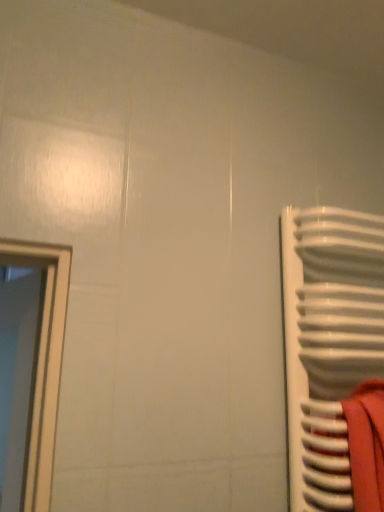
In the scene shown: In order to face white glossy radiator at right, should I rotate leftwards or rightwards?

To face it directly, rotate right by 24.909 degrees.

You are a GUI agent. You are given a task and a screenshot of the screen. Output one action in this format:
    pyautogui.click(x=<x>, y=<y>)
    Task: Click on the white glossy radiator at right
    The height and width of the screenshot is (512, 384).
    Given the screenshot: What is the action you would take?
    pyautogui.click(x=328, y=342)

What do you see at coordinates (328, 342) in the screenshot?
I see `white glossy radiator at right` at bounding box center [328, 342].

What do you see at coordinates (44, 362) in the screenshot?
I see `white glossy door at left` at bounding box center [44, 362].

The height and width of the screenshot is (512, 384). What are the coordinates of `white glossy door at left` in the screenshot? It's located at (44, 362).

Measure the distance between point (47, 325) and camera.

The depth of point (47, 325) is 83.30 centimeters.

This screenshot has height=512, width=384. Identify the location of white glossy radiator at right. (328, 342).

Is white glossy radiator at right at the left side of white glossy door at left?

Incorrect, white glossy radiator at right is not on the left side of white glossy door at left.

Is white glossy radiator at right further to camera compared to white glossy door at left?

No, white glossy radiator at right is closer to the viewer.

Is point (378, 244) more distant than point (51, 377)?

That is True.

From the image's perspective, which is above, white glossy radiator at right or white glossy door at left?

white glossy door at left, from the image's perspective.

From a real-world perspective, which object rests below the other?

From a 3D spatial view, white glossy radiator at right is below.

In the scene shown: Considering the sizes of white glossy radiator at right and white glossy door at left in the image, is white glossy radiator at right wider or thinner than white glossy door at left?

Clearly, white glossy radiator at right has more width compared to white glossy door at left.

Is white glossy radiator at right taller or shorter than white glossy door at left?

Considering their sizes, white glossy radiator at right has less height than white glossy door at left.

Can you confirm if white glossy radiator at right is smaller than white glossy door at left?

Yes, white glossy radiator at right is smaller than white glossy door at left.

Is white glossy radiator at right not within white glossy door at left?

white glossy radiator at right lies outside white glossy door at left's area.

Is white glossy radiator at right next to white glossy door at left and touching it?

There is a gap between white glossy radiator at right and white glossy door at left.

Is white glossy radiator at right oriented towards white glossy door at left?

No.

Find the location of a particular element. radiator below the white glossy door at left (from a real-world perspective) is located at coordinates (328, 342).

In the image, is white glossy door at left on the left side or the right side of white glossy radiator at right?

From the image, it's evident that white glossy door at left is to the left of white glossy radiator at right.

Is white glossy door at left further to the viewer compared to white glossy radiator at right?

Yes, white glossy door at left is further from the camera.

Does point (3, 258) lie behind point (321, 320)?

No, (3, 258) is in front of (321, 320).

From the image's perspective, is white glossy door at left located above white glossy radiator at right?

Yes.

Based on the photo, from a real-world perspective, is white glossy door at left under white glossy radiator at right?

Incorrect, from a real-world perspective, white glossy door at left is higher than white glossy radiator at right.

Which of these two, white glossy door at left or white glossy radiator at right, is thinner?

white glossy door at left is thinner.

Is white glossy door at left taller than white glossy radiator at right?

Yes.

Is white glossy door at left bigger than white glossy radiator at right?

Correct, white glossy door at left is larger in size than white glossy radiator at right.

Is white glossy door at left inside or outside of white glossy radiator at right?

The correct answer is: outside.

Consider the image. Does white glossy door at left touch white glossy radiator at right?

No, white glossy door at left is not next to white glossy radiator at right.

Could you tell me if white glossy door at left is facing white glossy radiator at right?

No, white glossy door at left is not oriented towards white glossy radiator at right.

How many degrees apart are the facing directions of white glossy door at left and white glossy radiator at right?

The angular difference between white glossy door at left and white glossy radiator at right is 73.9 degrees.

Identify the location of window above the white glossy radiator at right (from the image's perspective). (44, 362).

Where is `radiator that appears in front of the white glossy door at left`? radiator that appears in front of the white glossy door at left is located at coordinates [x=328, y=342].

Image resolution: width=384 pixels, height=512 pixels. What are the coordinates of `window that appears above the white glossy radiator at right (from the image's perspective)` in the screenshot? It's located at (44, 362).